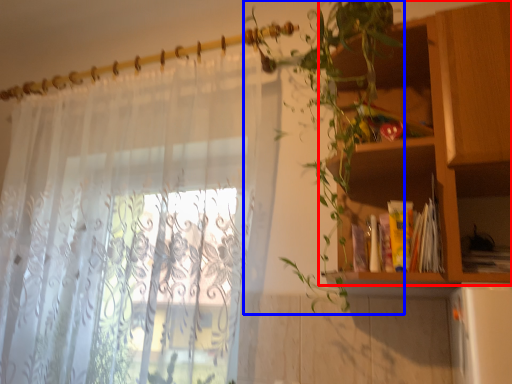
Question: Which object is closer to the camera taking this photo, shelf (highlighted by a red box) or vegetation (highlighted by a blue box)?

Choices:
 (A) shelf
 (B) vegetation

Answer: (B)